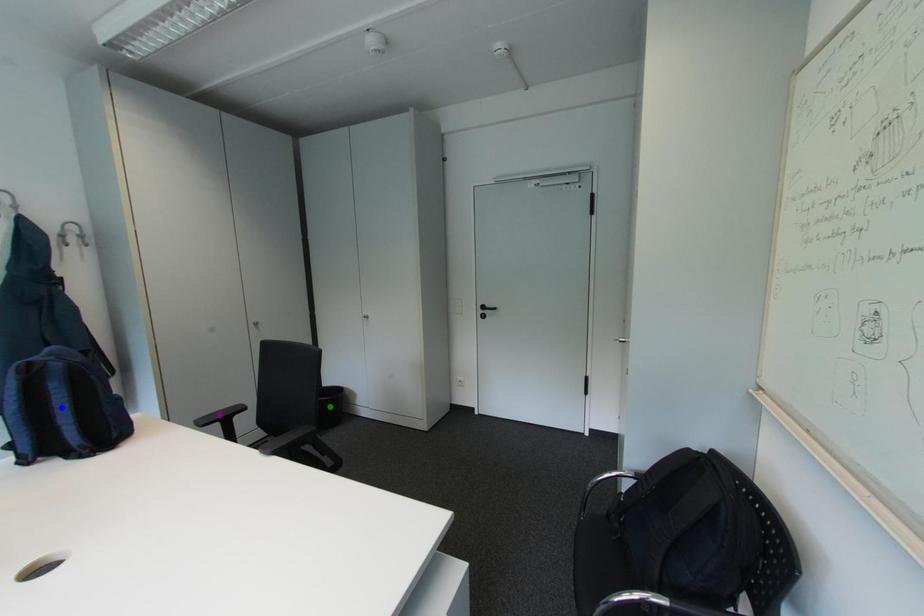
Order these from farthest to nearest:
blue point
purple point
green point

green point
purple point
blue point